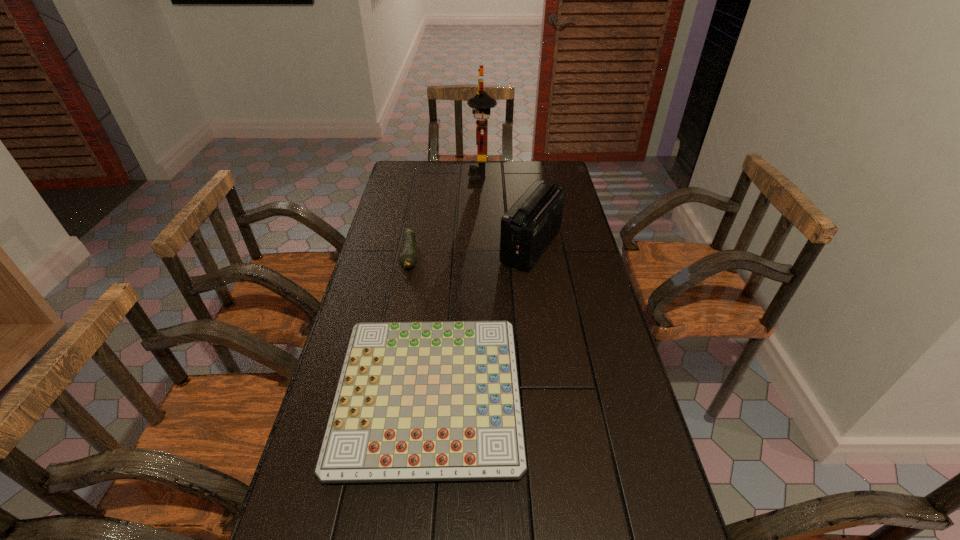
Where is `vacant region at the far right corner of the desktop`? This screenshot has width=960, height=540. vacant region at the far right corner of the desktop is located at coordinates (531, 172).

Where is `free area in between the nutcracker and the radio receiver`? This screenshot has height=540, width=960. free area in between the nutcracker and the radio receiver is located at coordinates (507, 212).

Find the location of a particular element. free space between the gameboard and the farthest object is located at coordinates (455, 286).

Image resolution: width=960 pixels, height=540 pixels. Find the location of `free space between the zucchini and the second tallest object`. free space between the zucchini and the second tallest object is located at coordinates (470, 251).

The width and height of the screenshot is (960, 540). Identify the location of free space between the zucchini and the nutcracker. (446, 216).

The image size is (960, 540). What are the coordinates of `unoccupied area between the nearest object and the radio receiver` in the screenshot? It's located at (480, 321).

You are a GUI agent. You are given a task and a screenshot of the screen. Output one action in this format:
    pyautogui.click(x=<x>, y=<y>)
    Task: Click on the object that can be found as the closest to the zucchini
    This screenshot has width=960, height=540.
    Given the screenshot: What is the action you would take?
    pyautogui.click(x=416, y=401)

Where is `object that stands as the third closest to the third shortest object`? This screenshot has width=960, height=540. object that stands as the third closest to the third shortest object is located at coordinates (407, 260).

The image size is (960, 540). I want to click on free location that satisfies the following two spatial constraints: 1. on the front-facing side of the tallest object; 2. at the blossom end of the zucchini, so click(482, 256).